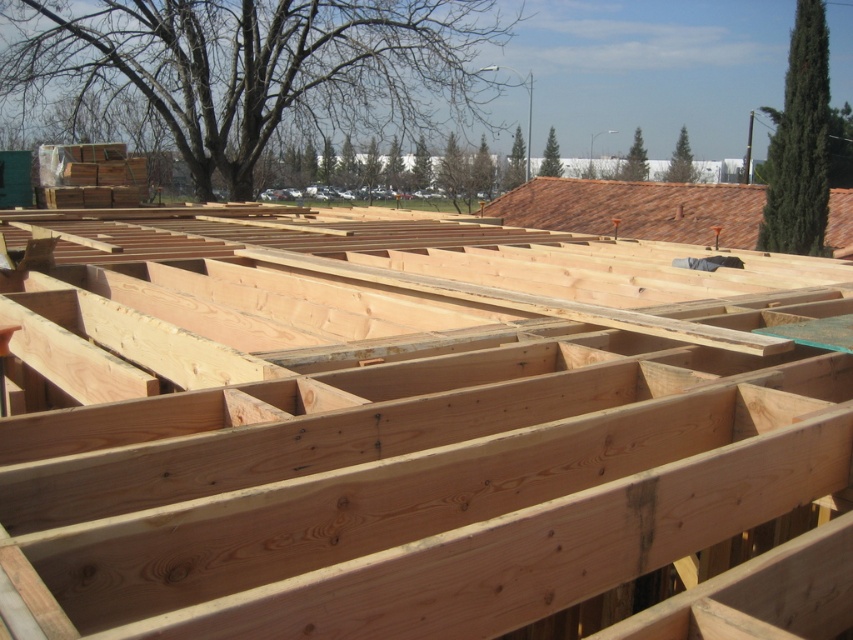
Question: Does natural wood beams at center have a greater width compared to brown tile roof at upper right?

Choices:
 (A) yes
 (B) no

Answer: (B)

Question: Can you confirm if natural wood beams at center is thinner than brown tile roof at upper right?

Choices:
 (A) yes
 (B) no

Answer: (A)

Question: Which point is farther to the camera?

Choices:
 (A) brown tile roof at upper right
 (B) natural wood beams at center

Answer: (A)

Question: Can you confirm if natural wood beams at center is wider than brown tile roof at upper right?

Choices:
 (A) no
 (B) yes

Answer: (A)